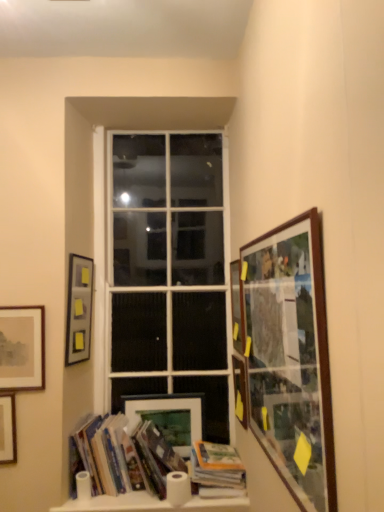
Locate an element on the screen. vacant space to the right of white matte toilet paper at lower center, which ranks as the 1th toilet paper in right-to-left order is located at coordinates (212, 497).